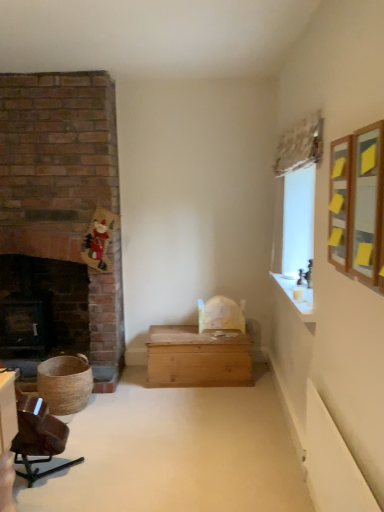
Describe the element at coordinates (295, 298) in the screenshot. I see `white glossy mantle at upper right` at that location.

What is the approximate height of black cast iron fireplace at left?

The height of black cast iron fireplace at left is 93.44 centimeters.

What do you see at coordinates (42, 308) in the screenshot?
I see `black cast iron fireplace at left` at bounding box center [42, 308].

Where is `white glossy mantle at upper right`? white glossy mantle at upper right is located at coordinates (295, 298).

From the image's perspective, is wooden chest at center over shiny brown leather chair at lower left?

Yes.

Is wooden chest at center aimed at shiny brown leather chair at lower left?

Yes, wooden chest at center faces towards shiny brown leather chair at lower left.

Considering the sizes of wooden chest at center and shiny brown leather chair at lower left in the image, is wooden chest at center taller or shorter than shiny brown leather chair at lower left?

Considering their sizes, wooden chest at center has less height than shiny brown leather chair at lower left.

You are a GUI agent. You are given a task and a screenshot of the screen. Output one action in this format:
    pyautogui.click(x=<x>, y=<y>)
    Task: Click on the table behind the shiny brown leather chair at lower left
    Image resolution: width=384 pixels, height=512 pixels.
    Given the screenshot: What is the action you would take?
    pyautogui.click(x=198, y=357)

Considering the sizes of objects wooden framed mirror at upper right and wooden chest at center in the image provided, who is smaller, wooden framed mirror at upper right or wooden chest at center?

With smaller size is wooden framed mirror at upper right.

How many degrees apart are the facing directions of wooden framed mirror at upper right and wooden chest at center?

The angular difference between wooden framed mirror at upper right and wooden chest at center is 92.3 degrees.

Is wooden framed mirror at upper right in front of or behind wooden chest at center in the image?

In the image, wooden framed mirror at upper right appears in front of wooden chest at center.

From a real-world perspective, is wooden framed mirror at upper right beneath wooden chest at center?

Actually, wooden framed mirror at upper right is physically above wooden chest at center in the real world.

Which of these two, white glossy mantle at upper right or wooden chest at center, is thinner?

white glossy mantle at upper right is thinner.

Looking at this image, is white glossy mantle at upper right directly adjacent to wooden chest at center?

They are not placed beside each other.

Considering the sizes of objects white glossy mantle at upper right and wooden chest at center in the image provided, who is taller, white glossy mantle at upper right or wooden chest at center?

With more height is wooden chest at center.

From a real-world perspective, who is located higher, black cast iron fireplace at left or shiny brown leather chair at lower left?

In real-world perspective, black cast iron fireplace at left is above.

Who is taller, black cast iron fireplace at left or shiny brown leather chair at lower left?

black cast iron fireplace at left is taller.

Consider the image. Is black cast iron fireplace at left closer to the viewer compared to shiny brown leather chair at lower left?

No, it is behind shiny brown leather chair at lower left.

Between black cast iron fireplace at left and shiny brown leather chair at lower left, which one appears on the right side from the viewer's perspective?

From the viewer's perspective, shiny brown leather chair at lower left appears more on the right side.

Which is more to the right, white glossy mantle at upper right or wooden framed mirror at upper right?

white glossy mantle at upper right.

Who is shorter, white glossy mantle at upper right or wooden framed mirror at upper right?

white glossy mantle at upper right is shorter.

From the picture: From a real-world perspective, is white glossy mantle at upper right under wooden framed mirror at upper right?

Correct, in the physical world, white glossy mantle at upper right is lower than wooden framed mirror at upper right.

Is there a large distance between white glossy mantle at upper right and wooden framed mirror at upper right?

They are positioned close to each other.

Image resolution: width=384 pixels, height=512 pixels. In order to click on table in front of the black cast iron fireplace at left in this screenshot , I will do `click(198, 357)`.

Can you confirm if wooden chest at center is wider than black cast iron fireplace at left?

Correct, the width of wooden chest at center exceeds that of black cast iron fireplace at left.

Does wooden chest at center appear on the right side of black cast iron fireplace at left?

Yes.

In terms of size, does black cast iron fireplace at left appear bigger or smaller than wooden chest at center?

Considering their sizes, black cast iron fireplace at left takes up less space than wooden chest at center.

Which is closer to the camera, (50, 277) or (236, 365)?

Point (236, 365)

Is black cast iron fireplace at left far from wooden chest at center?

That's right, there is a large distance between black cast iron fireplace at left and wooden chest at center.

The width and height of the screenshot is (384, 512). What are the coordinates of `table below the shiny brown leather chair at lower left (from a real-world perspective)` in the screenshot? It's located at (198, 357).

I want to click on mirror above the wooden chest at center (from the image's perspective), so click(x=367, y=201).

In the scene shown: Which object lies nearer to the anchor point shiny brown leather chair at lower left, black cast iron fireplace at left or wooden chest at center?

wooden chest at center is positioned closer to the anchor shiny brown leather chair at lower left.

Estimate the real-world distances between objects in this image. Which object is closer to shiny brown leather chair at lower left, white glossy mantle at upper right or wooden framed mirror at upper right?

white glossy mantle at upper right.

From the image, which object appears to be nearer to black cast iron fireplace at left, white glossy mantle at upper right or shiny brown leather chair at lower left?

Among the two, shiny brown leather chair at lower left is located nearer to black cast iron fireplace at left.

Which object lies further to the anchor point white glossy mantle at upper right, shiny brown leather chair at lower left or wooden framed mirror at upper right?

shiny brown leather chair at lower left is further to white glossy mantle at upper right.

Looking at the image, which one is located closer to wooden framed mirror at upper right, white glossy mantle at upper right or wooden chest at center?

Based on the image, white glossy mantle at upper right appears to be nearer to wooden framed mirror at upper right.

Based on their spatial positions, is wooden framed mirror at upper right or black cast iron fireplace at left closer to shiny brown leather chair at lower left?

black cast iron fireplace at left is positioned closer to the anchor shiny brown leather chair at lower left.

In the scene shown: Which object lies nearer to the anchor point wooden chest at center, wooden framed mirror at upper right or black cast iron fireplace at left?

black cast iron fireplace at left lies closer to wooden chest at center than the other object.

Based on their spatial positions, is wooden framed mirror at upper right or white glossy mantle at upper right closer to wooden chest at center?

white glossy mantle at upper right is positioned closer to the anchor wooden chest at center.

Image resolution: width=384 pixels, height=512 pixels. I want to click on chair positioned between wooden framed mirror at upper right and wooden chest at center from near to far, so click(x=38, y=437).

This screenshot has height=512, width=384. I want to click on chair between black cast iron fireplace at left and white glossy mantle at upper right in the horizontal direction, so click(38, 437).

The image size is (384, 512). What are the coordinates of `mantle located between wooden framed mirror at upper right and wooden chest at center in the depth direction` in the screenshot? It's located at (295, 298).

Find the location of a particular element. The width and height of the screenshot is (384, 512). table between shiny brown leather chair at lower left and black cast iron fireplace at left from front to back is located at coordinates (198, 357).